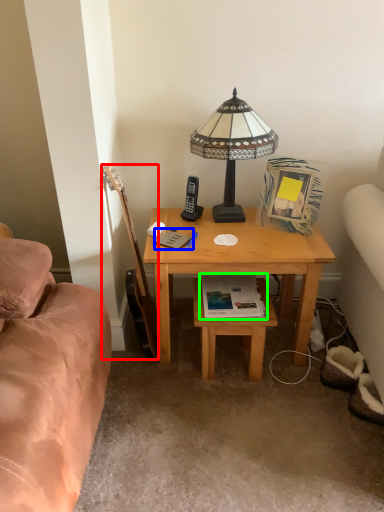
Question: Which is nearer to the guitar (highlighted by a red box)? book (highlighted by a blue box) or book (highlighted by a green box).

Choices:
 (A) book
 (B) book

Answer: (A)